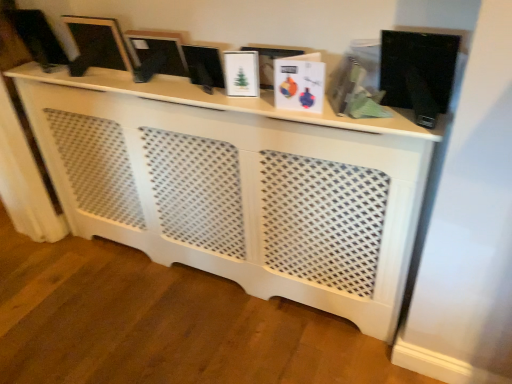
This screenshot has height=384, width=512. What are the coordinates of `vacant area that is in front of white lattice cabinet at center` in the screenshot? It's located at (214, 330).